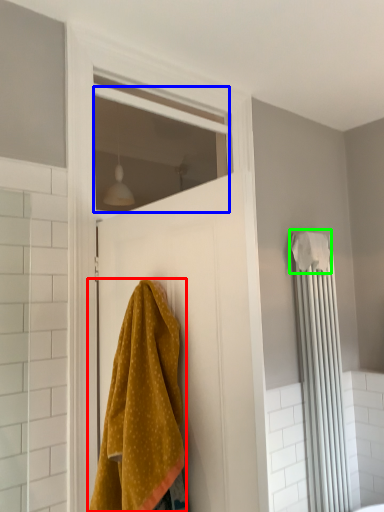
Question: Considering the real-world distances, which object is closest to towel (highlighted by a red box)? window (highlighted by a blue box) or bath towel (highlighted by a green box).

Choices:
 (A) window
 (B) bath towel

Answer: (B)